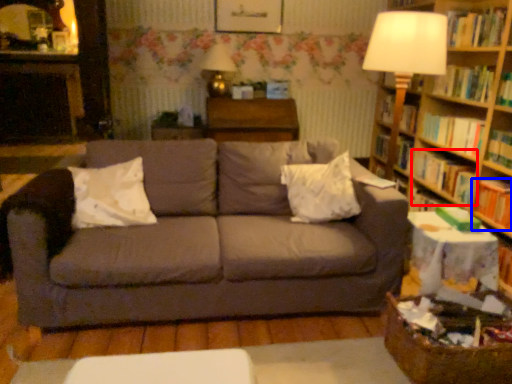
Question: Which object is closer to the camera taking this photo, book (highlighted by a red box) or book (highlighted by a blue box)?

Choices:
 (A) book
 (B) book

Answer: (B)